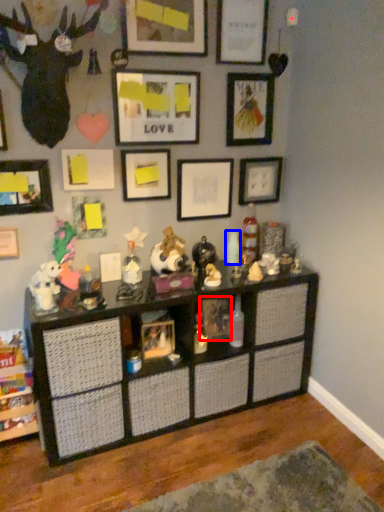
Question: Among these objects, which one is nearest to the camera, picture frame (highlighted by a red box) or toy (highlighted by a blue box)?

Choices:
 (A) picture frame
 (B) toy

Answer: (A)